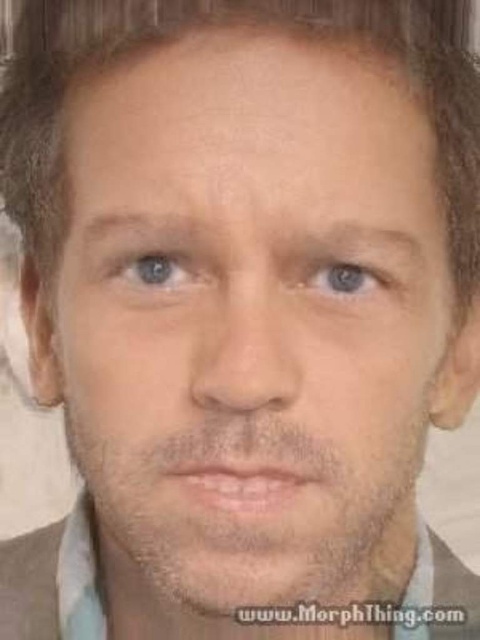
You are a photographer adjusting the lighting for a portrait. You notice two blue matte eyes in the frame. The blue matte eye at upper left and the blue matte eye at center. Which eye is closer to the camera?

The blue matte eye at center is closer to the camera because the blue matte eye at upper left is 1.63 inches away from it, indicating it is further back.

From the picture: You are an artist sketching a portrait and want to ensure the eyes are positioned correctly. Given the blue matte eye at upper left and the blue matte eye at center, which one is placed higher on the face?

The blue matte eye at upper left is placed higher on the face as it is positioned above the blue matte eye at center.